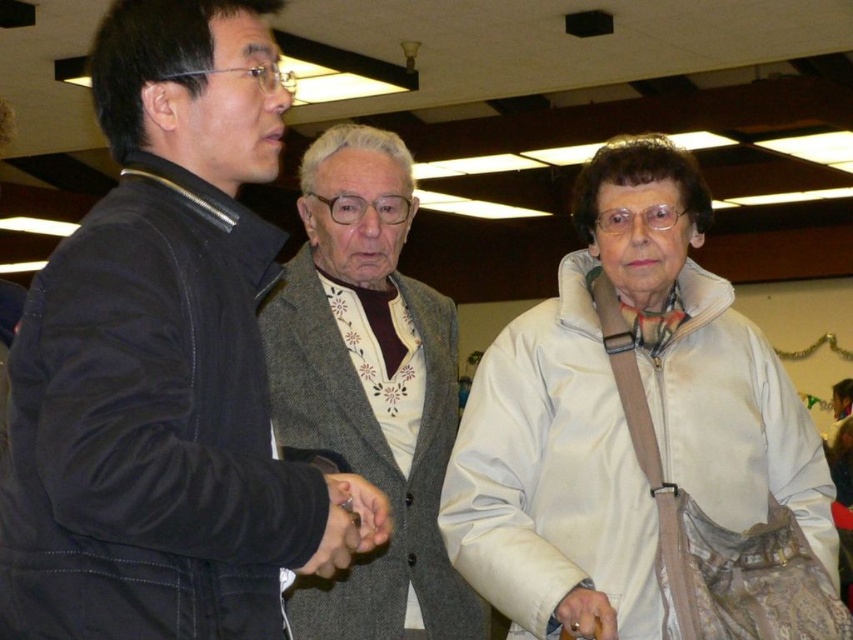
Is black leather jacket at left shorter than white fabric jacket at center?

Indeed, black leather jacket at left has a lesser height compared to white fabric jacket at center.

Does black leather jacket at left have a greater width compared to white fabric jacket at center?

No.

Find the location of a particular element. The width and height of the screenshot is (853, 640). black leather jacket at left is located at coordinates (165, 364).

Between point (654, 216) and point (334, 272), which one is positioned behind?

Positioned behind is point (334, 272).

Is point (625, 566) closer to viewer compared to point (268, 332)?

Yes, it is.

Is point (527, 472) positioned behind point (430, 346)?

No, (527, 472) is closer to viewer.

Locate an element on the screen. This screenshot has width=853, height=640. white fabric jacket at center is located at coordinates (622, 417).

Describe the element at coordinates (165, 364) in the screenshot. I see `black leather jacket at left` at that location.

Is black leather jacket at left below gray wool sweater at center?

No, black leather jacket at left is not below gray wool sweater at center.

Is point (12, 611) positioned behind point (352, 204)?

That is False.

Locate an element on the screen. Image resolution: width=853 pixels, height=640 pixels. black leather jacket at left is located at coordinates (x=165, y=364).